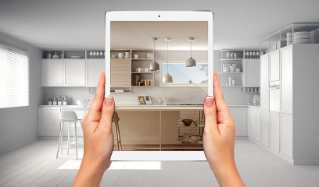
In order to click on shelf in this screenshot , I will do 132,66.